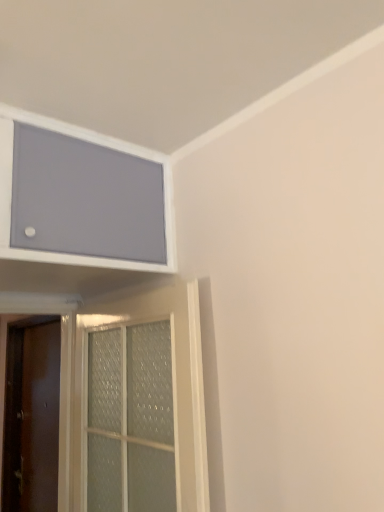
Question: Considering the relative positions of clear glass door at lower left, which is counted as the first door, starting from the right, and matte gray screen at upper left in the image provided, is clear glass door at lower left, which is counted as the first door, starting from the right, to the left of matte gray screen at upper left from the viewer's perspective?

Choices:
 (A) yes
 (B) no

Answer: (B)

Question: From the image's perspective, is clear glass door at lower left, positioned as the 2th door in left-to-right order, over matte gray screen at upper left?

Choices:
 (A) no
 (B) yes

Answer: (A)

Question: Is clear glass door at lower left, acting as the 2th door starting from the back, oriented towards matte gray screen at upper left?

Choices:
 (A) no
 (B) yes

Answer: (A)

Question: Is clear glass door at lower left, acting as the 2th door starting from the back, not within matte gray screen at upper left?

Choices:
 (A) yes
 (B) no

Answer: (A)

Question: Relative to matte gray screen at upper left, is brown matte door at left, positioned as the 1th door in left-to-right order, in front or behind?

Choices:
 (A) behind
 (B) front

Answer: (A)

Question: Is point (39, 492) closer or farther from the camera than point (119, 164)?

Choices:
 (A) farther
 (B) closer

Answer: (A)

Question: From the image's perspective, relative to matte gray screen at upper left, is brown matte door at left, marked as the 1th door in a back-to-front arrangement, above or below?

Choices:
 (A) below
 (B) above

Answer: (A)

Question: Considering the positions of brown matte door at left, the second door from the front, and matte gray screen at upper left in the image, is brown matte door at left, the second door from the front, bigger or smaller than matte gray screen at upper left?

Choices:
 (A) small
 (B) big

Answer: (A)

Question: From their relative heights in the image, would you say matte gray screen at upper left is taller or shorter than clear glass door at lower left, positioned as the 2th door in left-to-right order?

Choices:
 (A) tall
 (B) short

Answer: (B)

Question: From the image's perspective, is matte gray screen at upper left above or below clear glass door at lower left, acting as the 2th door starting from the back?

Choices:
 (A) above
 (B) below

Answer: (A)

Question: In terms of size, does matte gray screen at upper left appear bigger or smaller than clear glass door at lower left, which is counted as the first door, starting from the front?

Choices:
 (A) big
 (B) small

Answer: (A)

Question: Based on their positions, is matte gray screen at upper left located to the left or right of clear glass door at lower left, positioned as the 2th door in left-to-right order?

Choices:
 (A) right
 (B) left

Answer: (B)

Question: Considering the positions of clear glass door at lower left, which is counted as the first door, starting from the front, and matte gray screen at upper left in the image, is clear glass door at lower left, which is counted as the first door, starting from the front, bigger or smaller than matte gray screen at upper left?

Choices:
 (A) small
 (B) big

Answer: (A)

Question: Is clear glass door at lower left, positioned as the 2th door in left-to-right order, in front of or behind matte gray screen at upper left in the image?

Choices:
 (A) front
 (B) behind

Answer: (B)